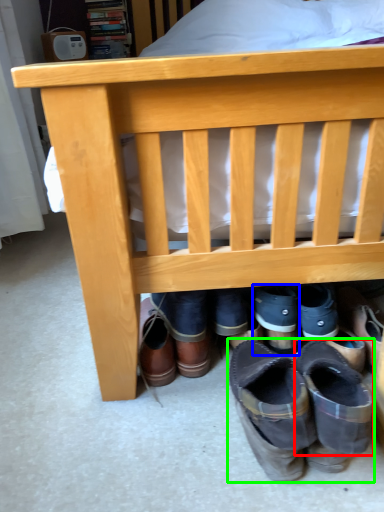
Question: Based on their relative distances, which object is farther from shoe (highlighted by a red box)? Choose from footwear (highlighted by a blue box) and footwear (highlighted by a green box).

Choices:
 (A) footwear
 (B) footwear

Answer: (A)